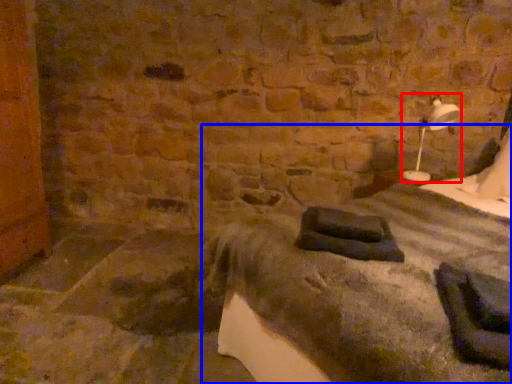
Question: Among these objects, which one is nearest to the camera, bedside lamp (highlighted by a red box) or bed (highlighted by a blue box)?

Choices:
 (A) bedside lamp
 (B) bed

Answer: (B)